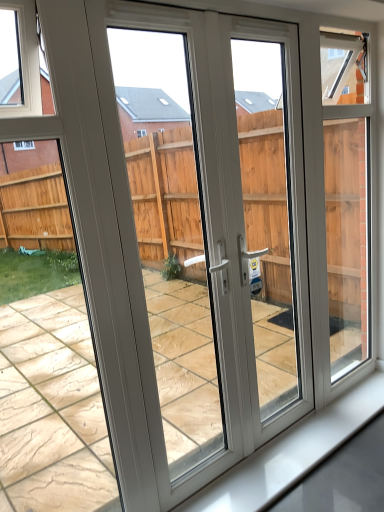
Question: Considering the relative sizes of white plastic screen door at center, placed as the first screen door when sorted from left to right, and white glossy window sill at lower center in the image provided, is white plastic screen door at center, placed as the first screen door when sorted from left to right, taller than white glossy window sill at lower center?

Choices:
 (A) yes
 (B) no

Answer: (A)

Question: Are white plastic screen door at center, placed as the first screen door when sorted from left to right, and white glossy window sill at lower center located far from each other?

Choices:
 (A) no
 (B) yes

Answer: (A)

Question: From the image's perspective, is white plastic screen door at center, placed as the first screen door when sorted from left to right, located beneath white glossy window sill at lower center?

Choices:
 (A) yes
 (B) no

Answer: (B)

Question: Does white plastic screen door at center, placed as the first screen door when sorted from left to right, have a greater width compared to white glossy window sill at lower center?

Choices:
 (A) yes
 (B) no

Answer: (B)

Question: Is white plastic screen door at center, which is the second screen door in right-to-left order, completely or partially outside of white glossy window sill at lower center?

Choices:
 (A) no
 (B) yes

Answer: (B)

Question: Is white plastic screen door at center, which is the second screen door in right-to-left order, thinner than white glossy window sill at lower center?

Choices:
 (A) no
 (B) yes

Answer: (B)

Question: Can you confirm if white plastic screen door at center, the first screen door viewed from the right, is thinner than white glossy window sill at lower center?

Choices:
 (A) no
 (B) yes

Answer: (B)

Question: From the image's perspective, is white plastic screen door at center, the first screen door viewed from the right, located beneath white glossy window sill at lower center?

Choices:
 (A) yes
 (B) no

Answer: (B)

Question: From a real-world perspective, is white plastic screen door at center, the first screen door viewed from the right, on white glossy window sill at lower center?

Choices:
 (A) yes
 (B) no

Answer: (A)

Question: Is white glossy window sill at lower center at the back of white plastic screen door at center, the first screen door viewed from the right?

Choices:
 (A) no
 (B) yes

Answer: (A)

Question: Is white plastic screen door at center, placed as the 2th screen door when sorted from left to right, at the left side of white glossy window sill at lower center?

Choices:
 (A) no
 (B) yes

Answer: (B)

Question: Is white plastic screen door at center, placed as the 2th screen door when sorted from left to right, facing towards white glossy window sill at lower center?

Choices:
 (A) yes
 (B) no

Answer: (A)

Question: Does white plastic screen door at center, placed as the 2th screen door when sorted from left to right, turn towards white plastic screen door at center, which is the second screen door in right-to-left order?

Choices:
 (A) no
 (B) yes

Answer: (A)